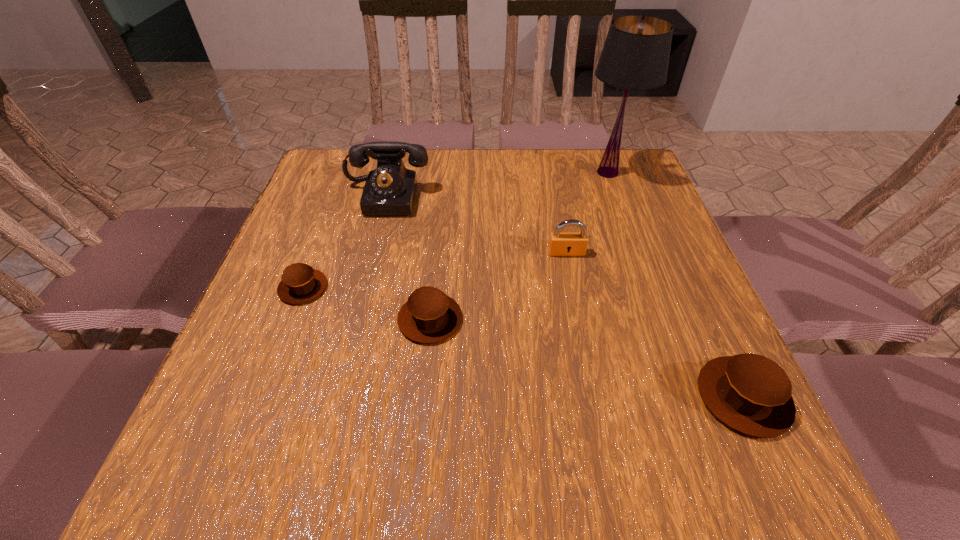
Where is `free space located on the right of the shortest object`? free space located on the right of the shortest object is located at coordinates (414, 288).

Where is `vacant space located on the left of the second tallest muffin`? vacant space located on the left of the second tallest muffin is located at coordinates (316, 319).

You are a GUI agent. You are given a task and a screenshot of the screen. Output one action in this format:
    pyautogui.click(x=<x>, y=<y>)
    Task: Click on the vacant area situated 0.160m on the left of the tallest muffin
    
    Given the screenshot: What is the action you would take?
    pyautogui.click(x=603, y=397)

This screenshot has width=960, height=540. I want to click on vacant space situated on the front-facing side of the tallest object, so click(622, 213).

This screenshot has width=960, height=540. In order to click on free location located on the dial of the telephone in this screenshot , I will do `click(371, 264)`.

This screenshot has width=960, height=540. Find the location of `free location located to unlock the third farthest object from the front`. free location located to unlock the third farthest object from the front is located at coordinates [588, 360].

I want to click on lampshade located in the far edge section of the desktop, so click(635, 56).

This screenshot has width=960, height=540. Find the location of `telephone at the far edge`. telephone at the far edge is located at coordinates (390, 189).

Where is `object located in the near edge section of the desktop`? The image size is (960, 540). object located in the near edge section of the desktop is located at coordinates (750, 393).

Image resolution: width=960 pixels, height=540 pixels. I want to click on muffin located in the left edge section of the desktop, so click(x=300, y=283).